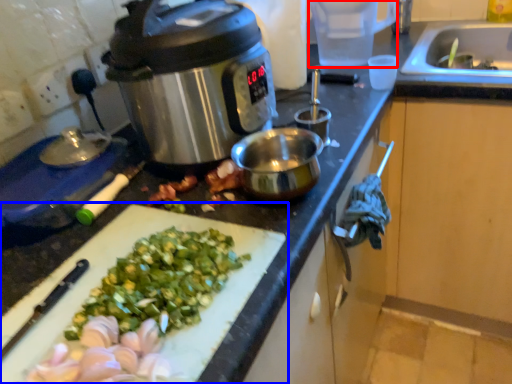
Question: Which point is further to the camera, appliance (highlighted by a red box) or cutting board (highlighted by a blue box)?

Choices:
 (A) appliance
 (B) cutting board

Answer: (A)